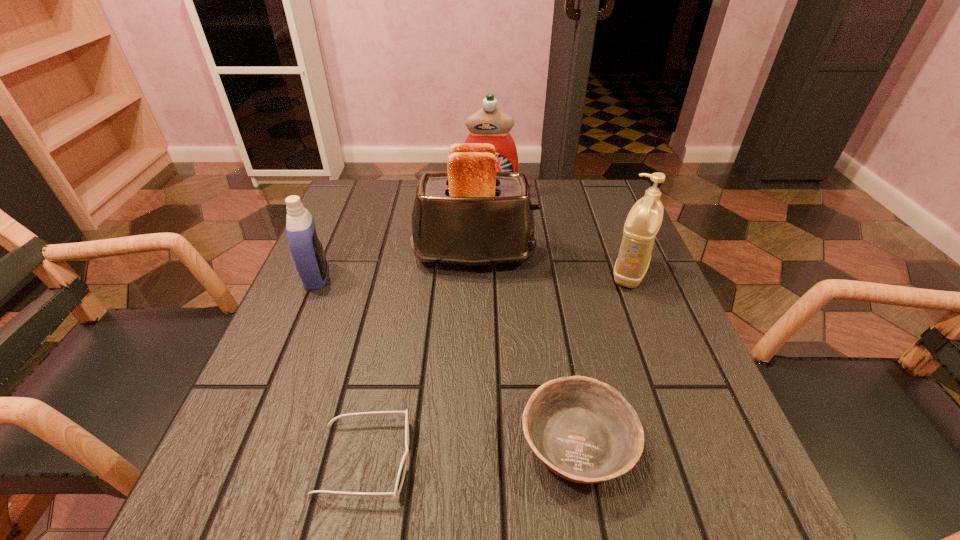
The image size is (960, 540). I want to click on empty space between the bowl and the leftmost detergent, so click(446, 360).

The image size is (960, 540). Identify the location of free space between the toaster and the shortest object. (420, 357).

The width and height of the screenshot is (960, 540). What are the coordinates of `free space between the fifth tallest object and the shortest object` in the screenshot? It's located at (470, 452).

This screenshot has width=960, height=540. In order to click on free space that is in between the bowl and the sunglasses in this screenshot , I will do `click(470, 452)`.

You are a GUI agent. You are given a task and a screenshot of the screen. Output one action in this format:
    pyautogui.click(x=<x>, y=<y>)
    Task: Click on the free point between the toaster and the leftmost detergent
    The height and width of the screenshot is (540, 960).
    Given the screenshot: What is the action you would take?
    pyautogui.click(x=396, y=266)

Where is `vacant area between the leftmost object and the shortest object`? This screenshot has width=960, height=540. vacant area between the leftmost object and the shortest object is located at coordinates (340, 368).

This screenshot has height=540, width=960. Find the location of `vacant space in between the toaster and the sunglasses`. vacant space in between the toaster and the sunglasses is located at coordinates tap(420, 357).

The height and width of the screenshot is (540, 960). What are the coordinates of `unoccupied area between the bowl and the rightmost object` in the screenshot? It's located at (603, 359).

Select which object is the second closest to the bowl. Please provide its 2D coordinates. Your answer should be formatted as a tuple, i.e. [(x, y)], where the tuple contains the x and y coordinates of a point satisfying the conditions above.

[(644, 220)]

At what (x,y) coordinates should I click in order to perform the action: click on object that stands as the fifth closest to the leftmost object. Please return your answer as a coordinate pair (x, y). Looking at the image, I should click on (644, 220).